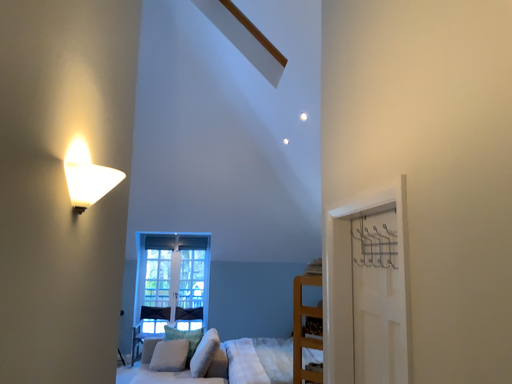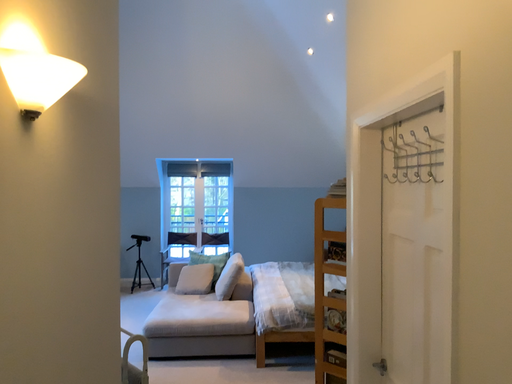
Question: How did the camera likely rotate when shooting the video?

Choices:
 (A) rotated downward
 (B) rotated upward

Answer: (A)